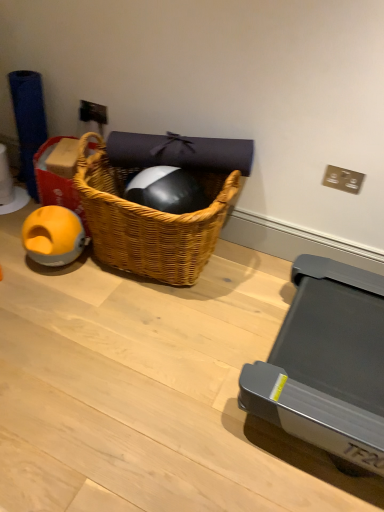
Question: Is metallic silver power outlet at upper center bigger or smaller than orange rubber ball at left?

Choices:
 (A) big
 (B) small

Answer: (B)

Question: Considering the positions of metallic silver power outlet at upper center and orange rubber ball at left in the image, is metallic silver power outlet at upper center wider or thinner than orange rubber ball at left?

Choices:
 (A) thin
 (B) wide

Answer: (A)

Question: Which object is the closest to the woven wood picnic basket at center?

Choices:
 (A) orange rubber ball at left
 (B) metallic silver power outlet at upper center
 (C) yellow rubber ball at left

Answer: (C)

Question: Which object is the closest to the woven wood picnic basket at center?

Choices:
 (A) metallic silver power outlet at upper center
 (B) orange rubber ball at left
 (C) yellow rubber ball at left

Answer: (C)